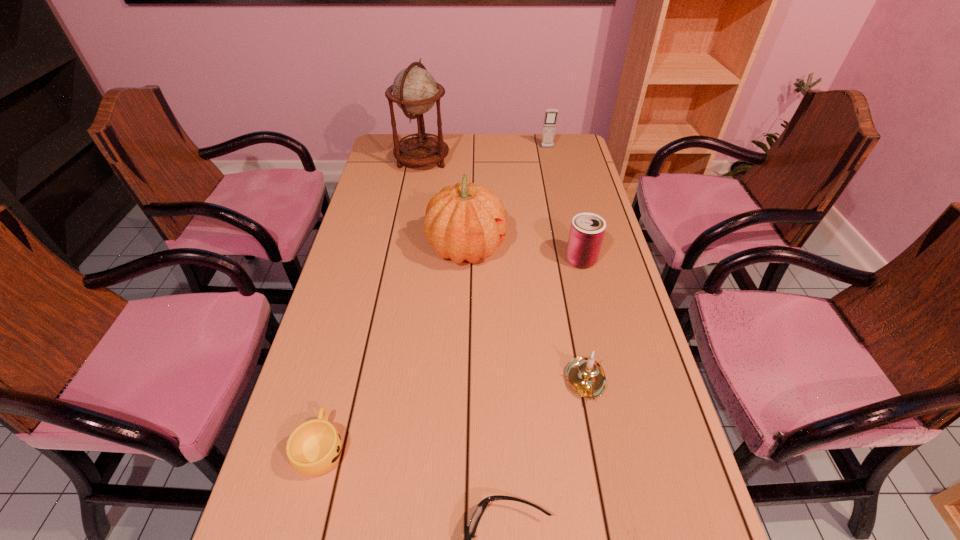
I want to click on the tallest object, so click(415, 91).

I want to click on pumpkin, so click(462, 222).

The image size is (960, 540). I want to click on cellular telephone, so click(550, 119).

Identify the location of can. (587, 230).

At what (x,y) coordinates should I click in order to perform the action: click on the third shortest object. Please return your answer as a coordinate pair (x, y). This screenshot has width=960, height=540. Looking at the image, I should click on (585, 376).

Locate an element on the screen. This screenshot has height=540, width=960. the third nearest object is located at coordinates (585, 376).

Find the location of a particular element. This screenshot has height=540, width=960. cup is located at coordinates (313, 448).

The height and width of the screenshot is (540, 960). In order to click on the second nearest object in this screenshot , I will do `click(313, 448)`.

You are a GUI agent. You are given a task and a screenshot of the screen. Output one action in this format:
    pyautogui.click(x=<x>, y=<y>)
    Task: Click on the vacant space located on the surface of the tallest object
    The image size is (960, 540).
    Given the screenshot: What is the action you would take?
    pyautogui.click(x=465, y=161)

The height and width of the screenshot is (540, 960). What are the coordinates of `vacant space located on the carved face of the pumpkin` in the screenshot? It's located at (588, 249).